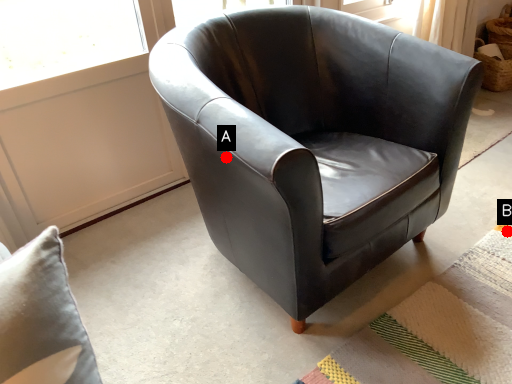
Question: Two points are circled on the image, labeled by A and B beside each circle. Which point is further to the camera?

Choices:
 (A) A is further
 (B) B is further

Answer: (B)